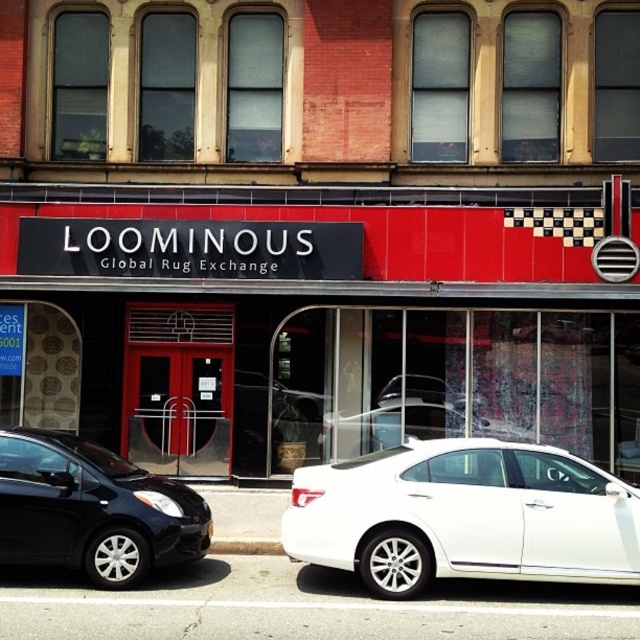
Based on the photo, you are standing at the entrance of Loominous Global Rug Exchange and notice a white metallic sedan at center. Based on its coordinates, can you determine if the sedan is closer to the entrance or the upper windows?

The white metallic sedan at center is located at point (464, 515), which places it closer to the entrance than the upper windows.